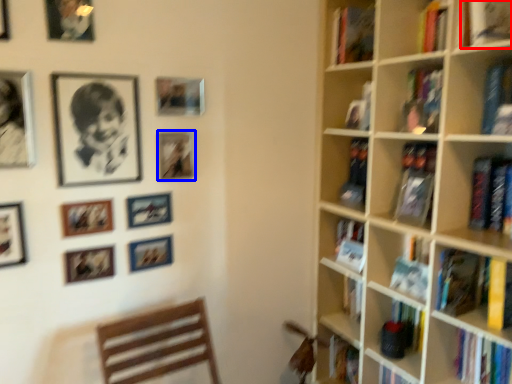
Question: Which point is further to the camera, book (highlighted by a red box) or picture frame (highlighted by a blue box)?

Choices:
 (A) book
 (B) picture frame

Answer: (B)